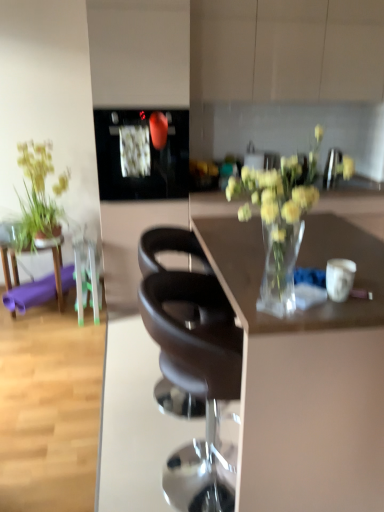
Question: Considering the relative positions of purple rubber mat at left and black glossy microwave at upper center in the image provided, is purple rubber mat at left to the left or to the right of black glossy microwave at upper center?

Choices:
 (A) right
 (B) left

Answer: (B)

Question: Which is correct: purple rubber mat at left is inside black glossy microwave at upper center, or outside of it?

Choices:
 (A) outside
 (B) inside

Answer: (A)

Question: Estimate the real-world distances between objects in this image. Which object is farther from the purple rubber mat at left?

Choices:
 (A) matte black chair at center, marked as the 1th chair in a front-to-back arrangement
 (B) black glossy microwave at upper center
 (C) translucent glass vase at center
 (D) transparent glass vase at center
 (E) green leafy plant at left

Answer: (D)

Question: Based on their relative distances, which object is nearer to the black leather chair at center, the 1th chair when ordered from back to front?

Choices:
 (A) translucent glass vase at center
 (B) purple rubber mat at left
 (C) transparent glass vase at center
 (D) matte black chair at center, marked as the 1th chair in a front-to-back arrangement
 (E) black glossy microwave at upper center

Answer: (D)